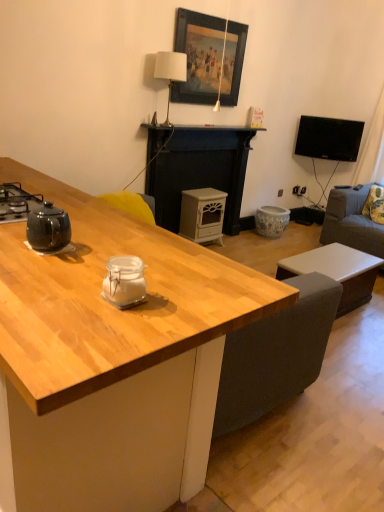
At what (x,y) coordinates should I click in order to perform the action: click on free space behind clear glass jar at center, marked as the 2th appliance in a top-to-bottom arrangement. Please return your answer as a coordinate pair (x, y). The width and height of the screenshot is (384, 512). Looking at the image, I should click on (153, 272).